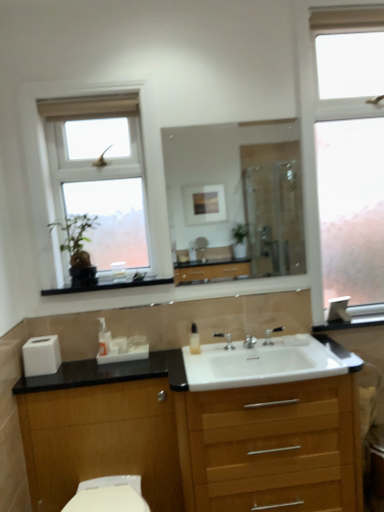
Locate an element on the screen. The width and height of the screenshot is (384, 512). free point to the right of translucent plastic soap dispenser at center, acting as the second soap dispenser starting from the left is located at coordinates (218, 353).